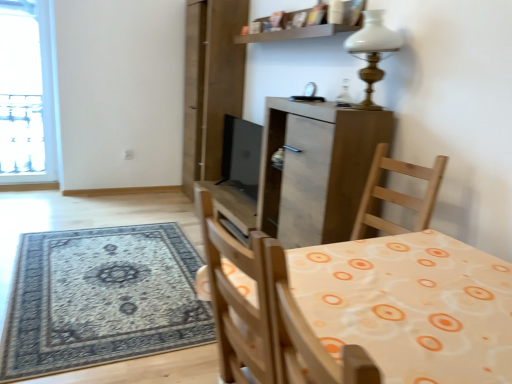
Question: From the image's perspective, does black matte screen door at upper center appear lower than wooden table at center?

Choices:
 (A) no
 (B) yes

Answer: (A)

Question: Considering the relative sizes of black matte screen door at upper center and wooden table at center in the image provided, is black matte screen door at upper center taller than wooden table at center?

Choices:
 (A) no
 (B) yes

Answer: (B)

Question: Could you tell me if black matte screen door at upper center is turned towards wooden table at center?

Choices:
 (A) no
 (B) yes

Answer: (A)

Question: Is black matte screen door at upper center completely or partially outside of wooden table at center?

Choices:
 (A) no
 (B) yes

Answer: (B)

Question: From the image's perspective, is black matte screen door at upper center above wooden table at center?

Choices:
 (A) no
 (B) yes

Answer: (B)

Question: Visually, is matte wood cabinet at center positioned to the left or to the right of wooden table at center?

Choices:
 (A) left
 (B) right

Answer: (B)

Question: From a real-world perspective, is matte wood cabinet at center physically located above or below wooden table at center?

Choices:
 (A) above
 (B) below

Answer: (B)

Question: Is point (271, 142) positioned closer to the camera than point (503, 370)?

Choices:
 (A) farther
 (B) closer

Answer: (A)

Question: From the image's perspective, is matte wood cabinet at center positioned above or below wooden table at center?

Choices:
 (A) below
 (B) above

Answer: (B)

Question: Is black matte screen door at upper center spatially inside wooden table at center, or outside of it?

Choices:
 (A) outside
 (B) inside

Answer: (A)

Question: Is black matte screen door at upper center taller or shorter than wooden table at center?

Choices:
 (A) tall
 (B) short

Answer: (A)

Question: From a real-world perspective, is black matte screen door at upper center above or below wooden table at center?

Choices:
 (A) below
 (B) above

Answer: (B)

Question: Does point (198, 96) appear closer or farther from the camera than point (433, 324)?

Choices:
 (A) farther
 (B) closer

Answer: (A)

Question: Is matte wood cabinet at center wider or thinner than white glass lamp at upper center?

Choices:
 (A) thin
 (B) wide

Answer: (B)

Question: From the image's perspective, is matte wood cabinet at center positioned above or below white glass lamp at upper center?

Choices:
 (A) above
 (B) below

Answer: (B)